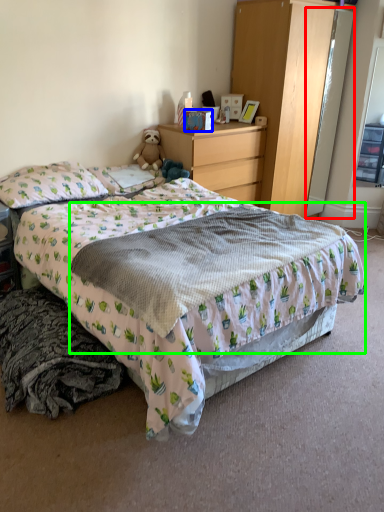
Question: Based on their relative distances, which object is farther from mirror (highlighted by a red box)? Choose from box (highlighted by a blue box) and blanket (highlighted by a green box).

Choices:
 (A) box
 (B) blanket

Answer: (B)